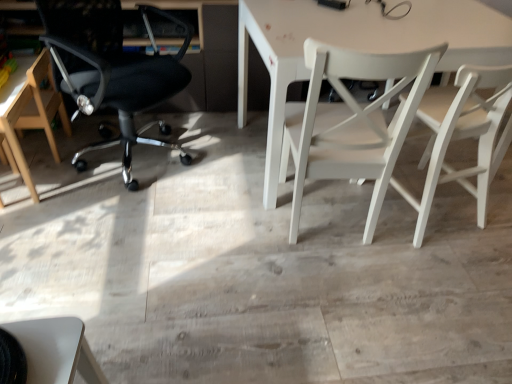
Identify the location of vacant area that lies in front of black mesh office chair at left, which is counted as the 3th chair, starting from the right. This screenshot has height=384, width=512. (115, 225).